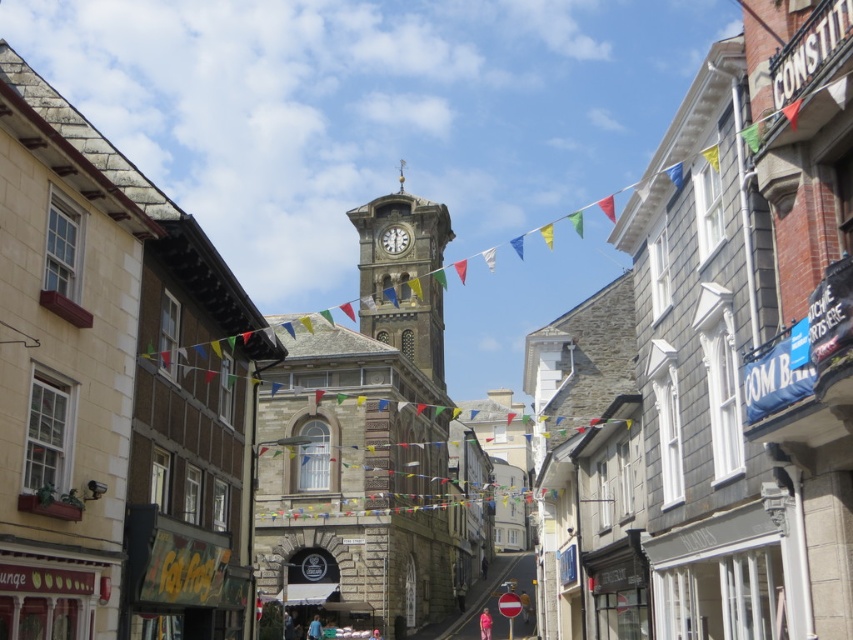
Who is more distant from viewer, (399,326) or (402,252)?

The point (402,252) is more distant.

Which of these two, stone clock tower at center or white stone clock at center, stands taller?

Standing taller between the two is stone clock tower at center.

Is point (395, 280) in front of point (405, 246)?

That is True.

Locate an element on the screen. stone clock tower at center is located at coordinates (403, 276).